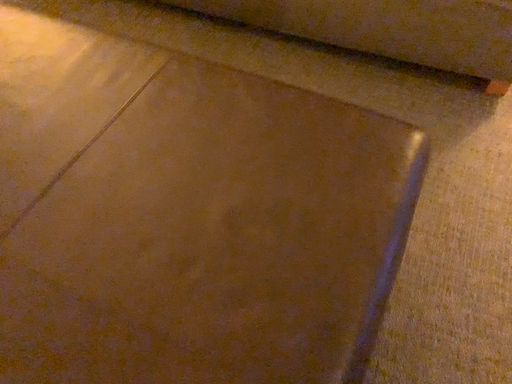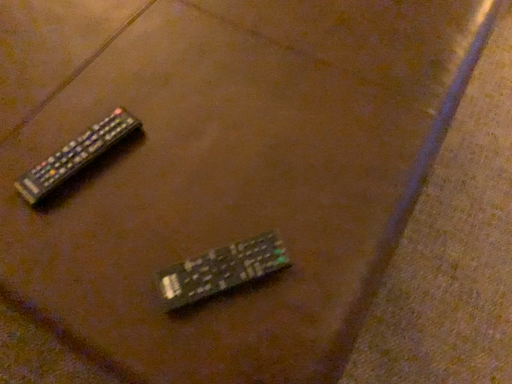
Question: Which way did the camera rotate in the video?

Choices:
 (A) rotated downward
 (B) rotated upward

Answer: (A)